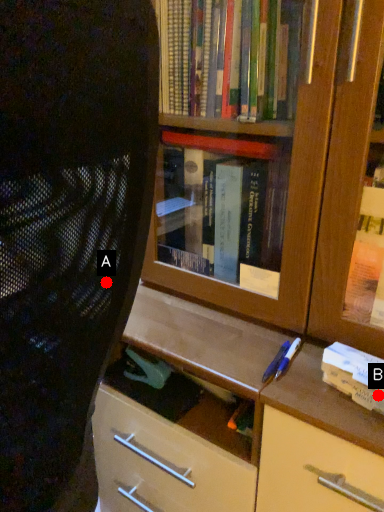
Question: Two points are circled on the image, labeled by A and B beside each circle. Which point is closer to the camera taking this photo?

Choices:
 (A) A is closer
 (B) B is closer

Answer: (A)